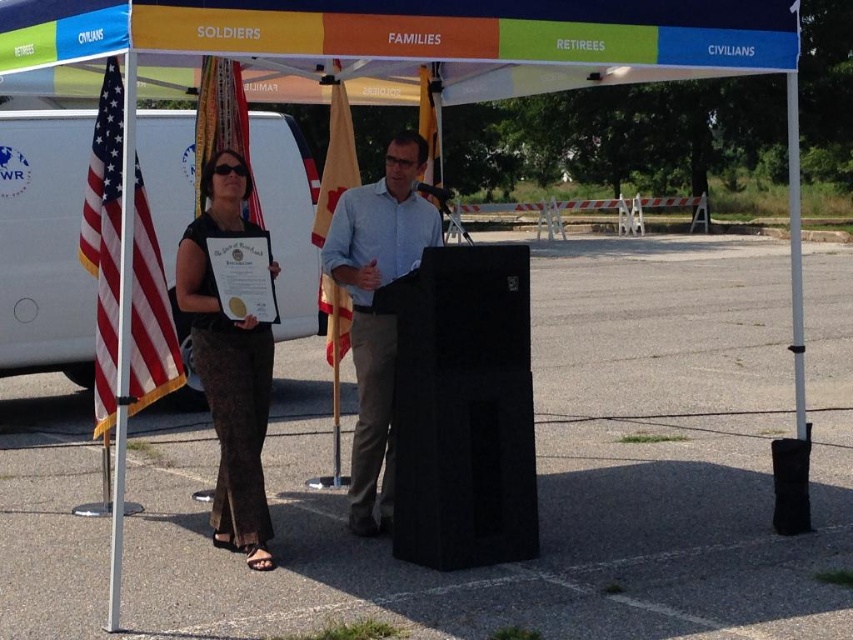
You are standing 15 feet away from the orange fabric canopy at center. Can you reach it without moving your feet?

The orange fabric canopy at center is 14.99 feet away from the viewer, so yes, you can reach it without moving your feet since you are standing exactly at that distance.

Based on the scene description, where is the orange fabric canopy at center located in terms of coordinates?

The orange fabric canopy at center is located at point coordinates of (x=392, y=44).

You are attending the event and want to take a photo with both the red fabric flag at center and the silky fabric flag at center. Since you want both flags to appear equally prominent in the photo, which flag should you move closer to the camera?

You should move the red fabric flag at center closer to the camera because it is smaller than the silky fabric flag at center, making them appear the same size in the photo.